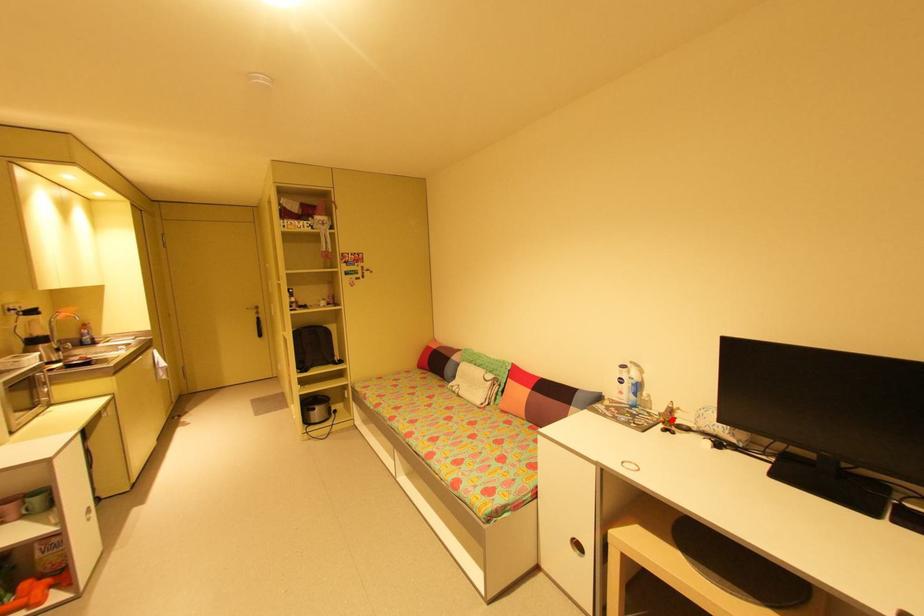
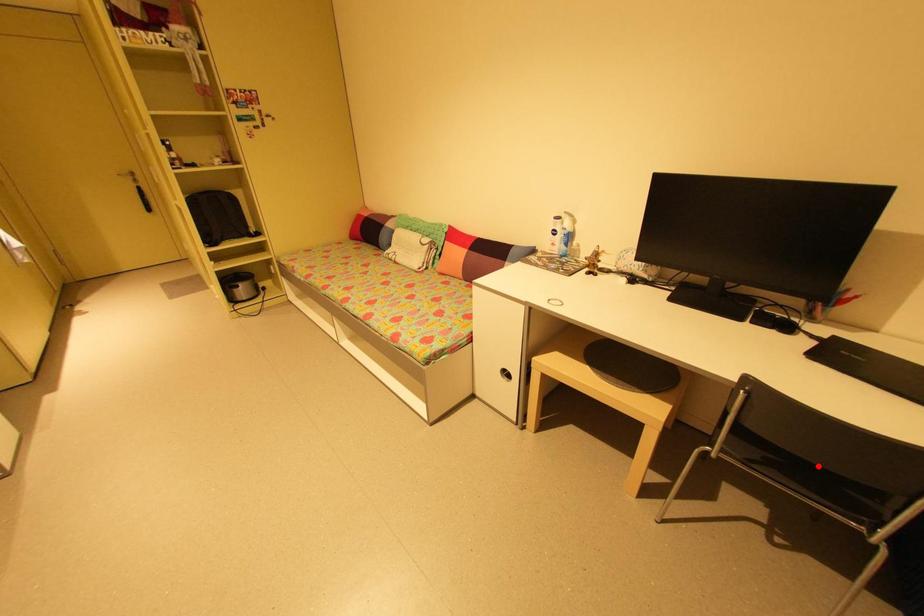
I am providing you with two images of the same scene from different viewpoints. A red point is marked on the first image and another point is marked on the second image. Is the marked point in image1 the same physical position as the marked point in image2?

No